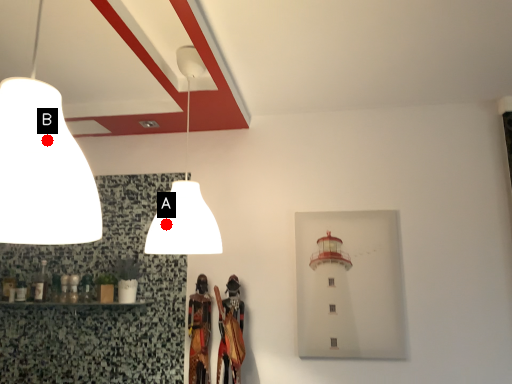
Question: Two points are circled on the image, labeled by A and B beside each circle. Among these points, which one is farthest from the camera?

Choices:
 (A) A is further
 (B) B is further

Answer: (A)